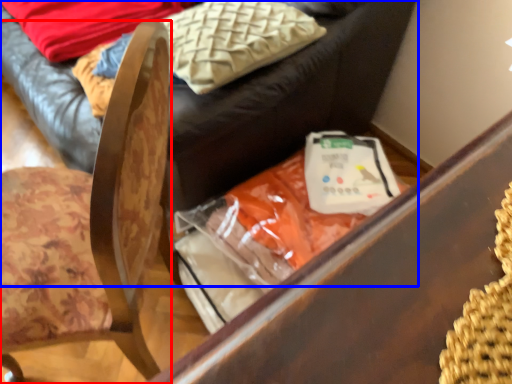
Question: Which object appears closest to the camera in this image, chair (highlighted by a red box) or furniture (highlighted by a blue box)?

Choices:
 (A) chair
 (B) furniture

Answer: (A)